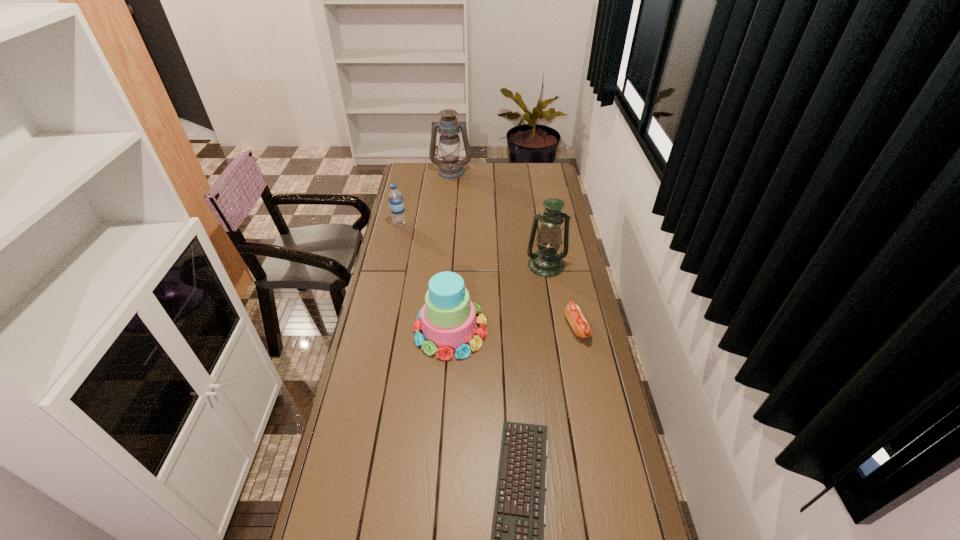
Find the location of a particular element. This screenshot has width=960, height=540. object that ranks as the second closest to the nearest object is located at coordinates (581, 327).

The height and width of the screenshot is (540, 960). I want to click on free space in the image that satisfies the following two spatial constraints: 1. on the back side of the sausage; 2. on the right side of the cake, so click(451, 327).

This screenshot has width=960, height=540. What are the coordinates of `vacant region that satisfies the following two spatial constraints: 1. on the back side of the cake; 2. on the right side of the right oil lamp` in the screenshot? It's located at (455, 265).

Where is `vacant point that satisfies the following two spatial constraints: 1. on the label of the leftmost object; 2. on the right side of the sausage`? This screenshot has width=960, height=540. vacant point that satisfies the following two spatial constraints: 1. on the label of the leftmost object; 2. on the right side of the sausage is located at coordinates (376, 327).